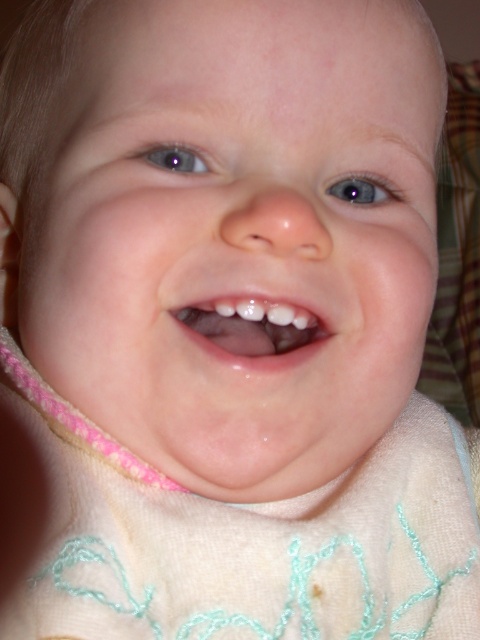
Question: Which of the following is the farthest from the observer?

Choices:
 (A) white glossy teeth at center
 (B) white soft bib at center

Answer: (A)

Question: Which object appears closest to the camera in this image?

Choices:
 (A) smooth skin baby at center
 (B) white glossy teeth at center
 (C) white soft bib at center

Answer: (A)

Question: Does smooth skin baby at center appear over white glossy teeth at center?

Choices:
 (A) yes
 (B) no

Answer: (A)

Question: Can you confirm if smooth skin baby at center is bigger than white glossy teeth at center?

Choices:
 (A) yes
 (B) no

Answer: (A)

Question: Does white soft bib at center have a lesser width compared to white glossy teeth at center?

Choices:
 (A) yes
 (B) no

Answer: (B)

Question: Considering the real-world distances, which object is farthest from the smooth skin baby at center?

Choices:
 (A) white glossy teeth at center
 (B) white soft bib at center

Answer: (B)